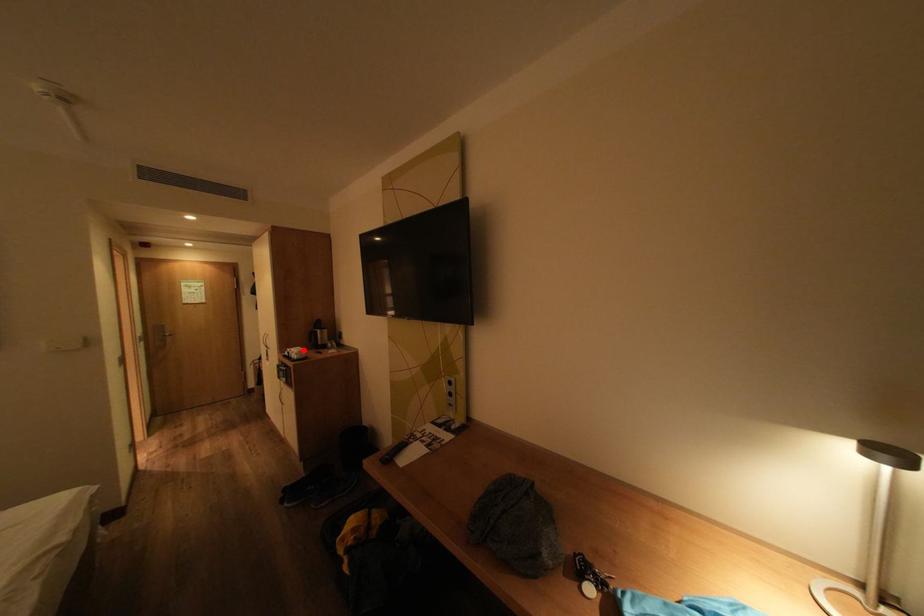
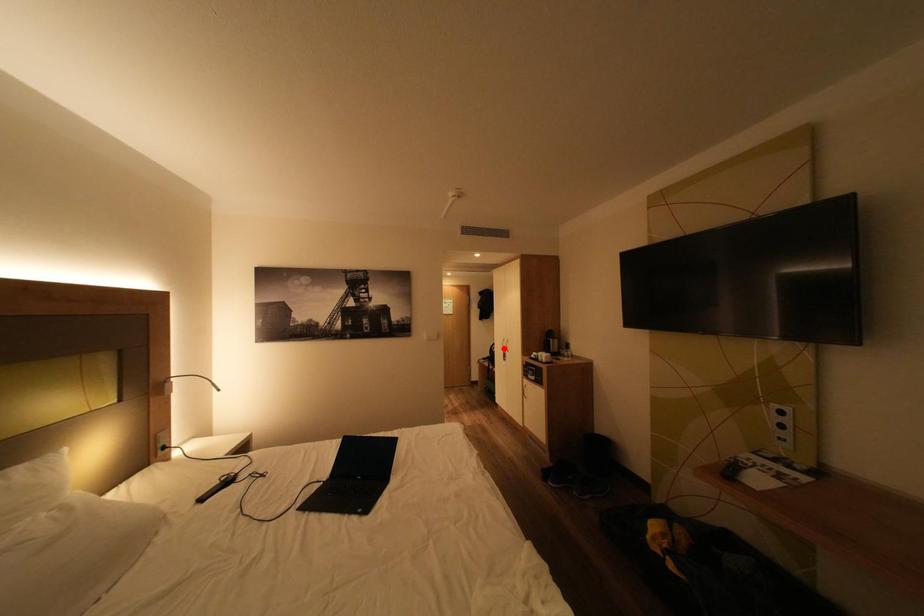
I am providing you with two images of the same scene from different viewpoints. A red point is marked on the first image and another point is marked on the second image. Does the point marked in image1 correspond to the same location as the one in image2?

No